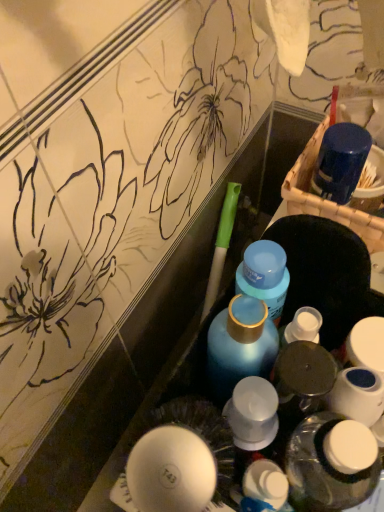
Question: Choose the correct answer: Is blue matte bottle at center, which is the first bottle in top-to-bottom order, inside white plastic bottle at center, arranged as the third bottle when viewed from the top, or outside it?

Choices:
 (A) outside
 (B) inside

Answer: (A)

Question: Considering their positions, is blue matte bottle at center, which is counted as the 3th bottle, starting from the bottom, located in front of or behind white plastic bottle at center, the 1th bottle when ordered from bottom to top?

Choices:
 (A) behind
 (B) front

Answer: (A)

Question: Which object is the closest to the white plastic bottle at center?

Choices:
 (A) blue matte bottle at center, which is the first bottle in top-to-bottom order
 (B) blue matte bottle at center, which appears as the 2th bottle when ordered from the bottom
 (C) white plastic bottle at center, the 1th bottle when ordered from bottom to top

Answer: (C)

Question: Which is farther from the white plastic bottle at center?

Choices:
 (A) white plastic bottle at center, arranged as the third bottle when viewed from the top
 (B) blue matte bottle at center, arranged as the second bottle when viewed from the top
 (C) blue matte bottle at center, which is counted as the 3th bottle, starting from the bottom

Answer: (C)